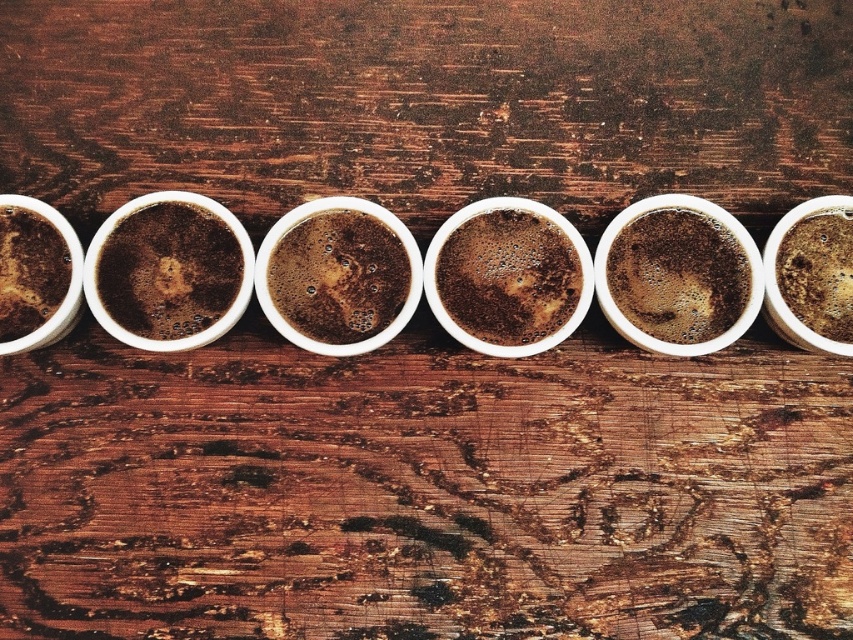
Which is below, brown matte cup at center or smokey brown foam at center?

brown matte cup at center is below.

Which is in front, point (485, 300) or point (671, 339)?

Point (671, 339) is more forward.

Between point (531, 243) and point (714, 305), which one is positioned in front?

Positioned in front is point (714, 305).

Locate an element on the screen. Image resolution: width=853 pixels, height=640 pixels. brown matte cup at center is located at coordinates (508, 276).

Between smokey brown foam at center and brown matte coffee at center, which one has less height?

Standing shorter between the two is smokey brown foam at center.

Can you confirm if smokey brown foam at center is thinner than brown matte coffee at center?

Incorrect, smokey brown foam at center's width is not less than brown matte coffee at center's.

Where is `smokey brown foam at center`? The width and height of the screenshot is (853, 640). smokey brown foam at center is located at coordinates (677, 275).

Is point (566, 236) more distant than point (352, 221)?

No.

The image size is (853, 640). Find the location of `brown matte cup at center`. brown matte cup at center is located at coordinates (508, 276).

Who is more forward, (532, 296) or (344, 328)?

Point (532, 296) is more forward.

Find the location of a particular element. This screenshot has height=640, width=853. brown matte cup at center is located at coordinates (508, 276).